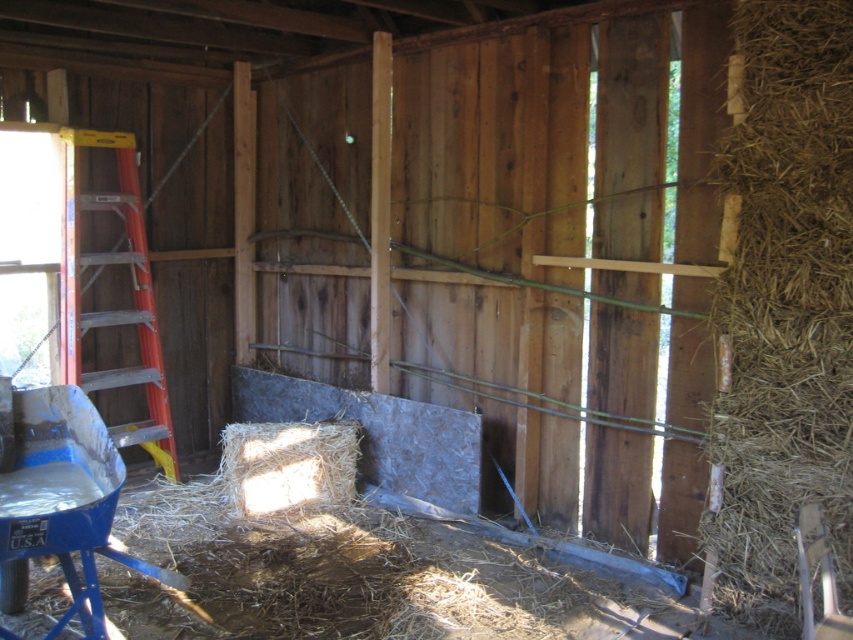
Question: Observing the image, what is the correct spatial positioning of brown straw at right in reference to orange aluminum ladder at left?

Choices:
 (A) left
 (B) right

Answer: (B)

Question: Which point is closer to the camera taking this photo?

Choices:
 (A) (149, 440)
 (B) (804, 35)

Answer: (B)

Question: Among these objects, which one is nearest to the camera?

Choices:
 (A) orange aluminum ladder at left
 (B) brown straw at right

Answer: (B)

Question: Is brown straw at right further to camera compared to orange aluminum ladder at left?

Choices:
 (A) no
 (B) yes

Answer: (A)

Question: Observing the image, what is the correct spatial positioning of brown straw at right in reference to orange aluminum ladder at left?

Choices:
 (A) right
 (B) left

Answer: (A)